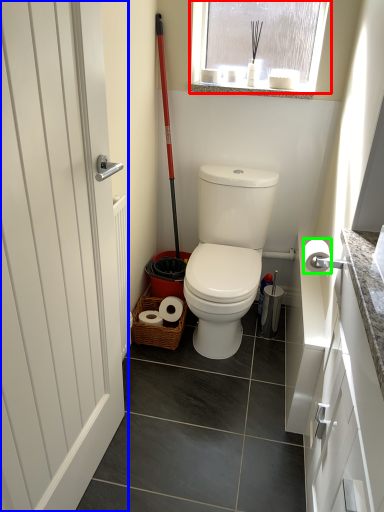
Question: Estimate the real-world distances between objects in this image. Which object is farther from window (highlighted by a red box), door (highlighted by a blue box) or toilet paper (highlighted by a green box)?

Choices:
 (A) door
 (B) toilet paper

Answer: (A)